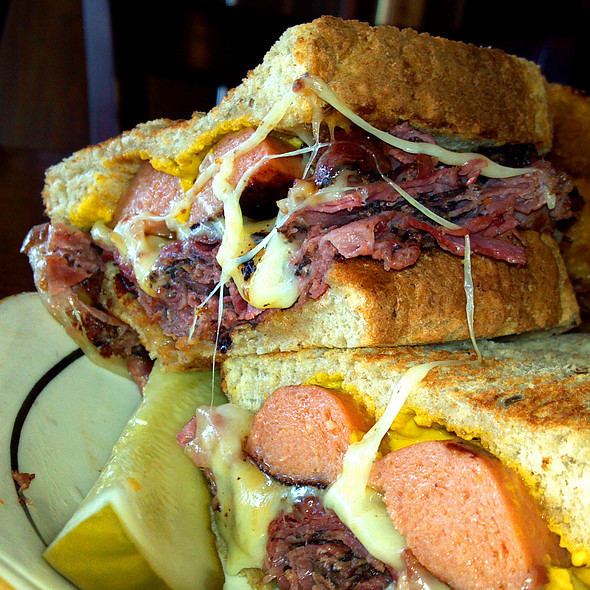
Where is `black line on white plate or bowl`? This screenshot has width=590, height=590. black line on white plate or bowl is located at coordinates (31, 413).